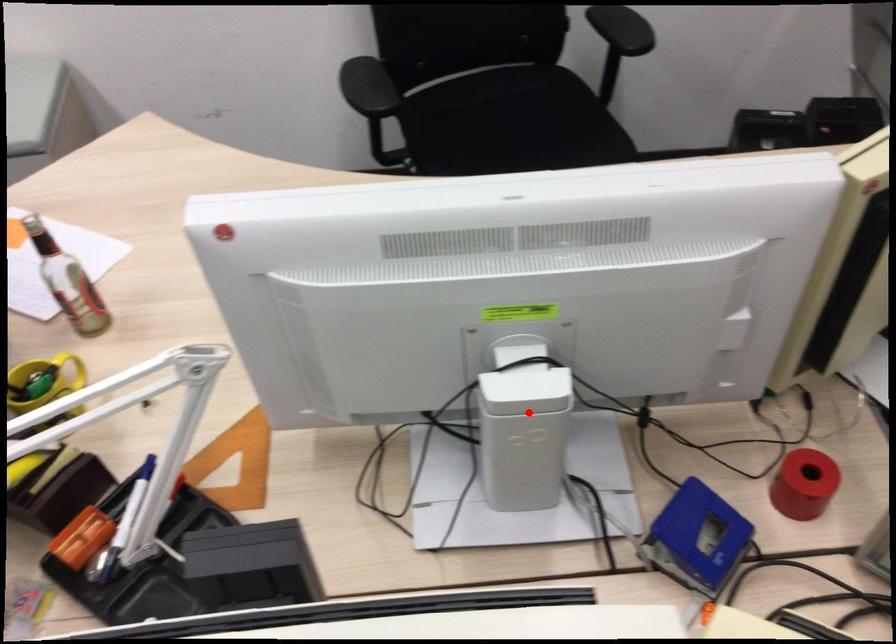
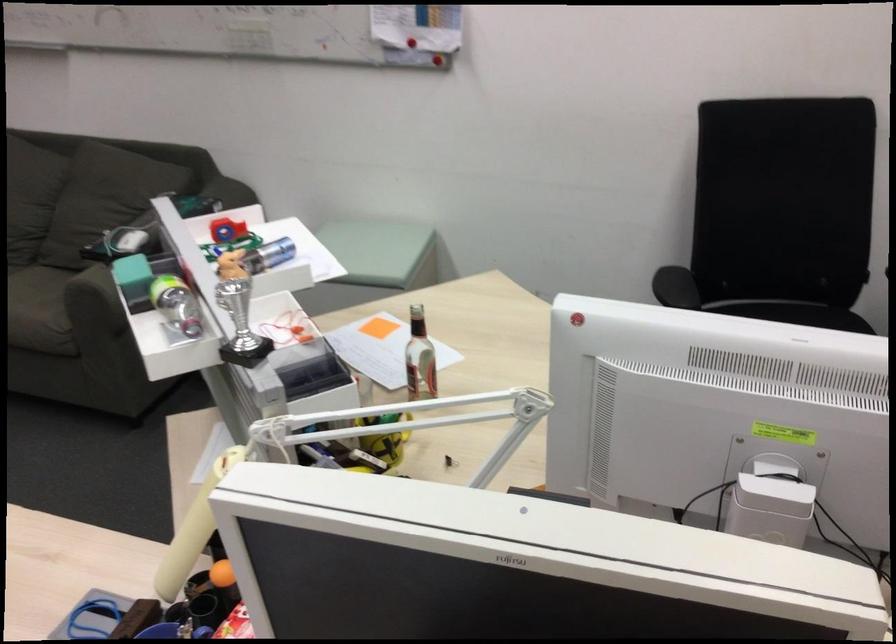
Question: I am providing you with two images of the same scene from different viewpoints. In image1, a red point is highlighted. Considering the same 3D point in image2, which of the following is correct?

Choices:
 (A) It is closer
 (B) It is farther

Answer: (B)